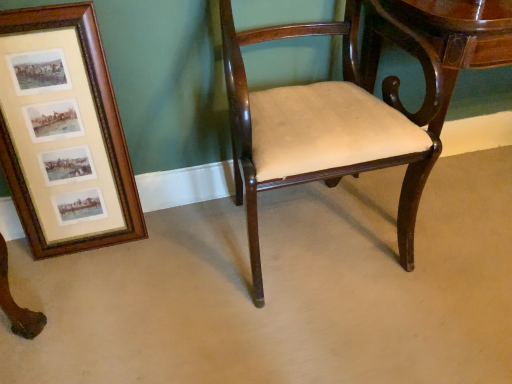
Describe the element at coordinates (64, 133) in the screenshot. I see `wooden frame at left` at that location.

Describe the element at coordinates (328, 124) in the screenshot. I see `mahogany wood chair at center` at that location.

I want to click on wooden frame at left, so click(64, 133).

Is mahogany wood chair at center a part of wooden frame at left?

No.

From the image's perspective, is wooden frame at left above mahogany wood chair at center?

Incorrect, from the image's perspective, wooden frame at left is lower than mahogany wood chair at center.

Can you confirm if wooden frame at left is positioned to the left of mahogany wood chair at center?

Yes.

Is wooden frame at left behind mahogany wood chair at center?

Yes, wooden frame at left is further from the viewer.

From the image's perspective, is mahogany wood chair at center located beneath glossy wood table at center?

Correct, mahogany wood chair at center appears lower than glossy wood table at center in the image.

From a real-world perspective, is mahogany wood chair at center physically above glossy wood table at center?

Correct, in the physical world, mahogany wood chair at center is higher than glossy wood table at center.

Is mahogany wood chair at center behind glossy wood table at center?

No, the depth of mahogany wood chair at center is less than that of glossy wood table at center.

From the image's perspective, is mahogany wood chair at center above wooden frame at left?

Correct, mahogany wood chair at center appears higher than wooden frame at left in the image.

Considering the sizes of objects mahogany wood chair at center and wooden frame at left in the image provided, who is taller, mahogany wood chair at center or wooden frame at left?

With more height is mahogany wood chair at center.

At what (x,y) coordinates should I click in order to perform the action: click on picture frame below the mahogany wood chair at center (from the image's perspective). Please return your answer as a coordinate pair (x, y). This screenshot has width=512, height=384. Looking at the image, I should click on (64, 133).

Is mahogany wood chair at center at the left side of wooden frame at left?

Incorrect, mahogany wood chair at center is not on the left side of wooden frame at left.

From a real-world perspective, is wooden frame at left positioned under glossy wood table at center based on gravity?

Incorrect, from a real-world perspective, wooden frame at left is higher than glossy wood table at center.

Based on the photo, is wooden frame at left not close to glossy wood table at center?

No.

Considering the sizes of objects wooden frame at left and glossy wood table at center in the image provided, who is wider, wooden frame at left or glossy wood table at center?

glossy wood table at center is wider.

From the image's perspective, between glossy wood table at center and mahogany wood chair at center, which one is located above?

glossy wood table at center.

Considering the sizes of objects glossy wood table at center and mahogany wood chair at center in the image provided, who is shorter, glossy wood table at center or mahogany wood chair at center?

With less height is glossy wood table at center.

Is glossy wood table at center thinner than mahogany wood chair at center?

Yes, glossy wood table at center is thinner than mahogany wood chair at center.

Is glossy wood table at center to the right of wooden frame at left from the viewer's perspective?

Yes, glossy wood table at center is to the right of wooden frame at left.

Which object is further away from the camera, glossy wood table at center or wooden frame at left?

glossy wood table at center is further away from the camera.

Would you say glossy wood table at center is inside or outside wooden frame at left?

The correct answer is: outside.

Between glossy wood table at center and wooden frame at left, which one has more height?

wooden frame at left is taller.

Locate an element on the screen. The width and height of the screenshot is (512, 384). picture frame to the left of mahogany wood chair at center is located at coordinates (64, 133).

Locate an element on the screen. This screenshot has width=512, height=384. table that appears on the right of mahogany wood chair at center is located at coordinates (426, 71).

Based on the photo, estimate the real-world distances between objects in this image. Which object is closer to glossy wood table at center, mahogany wood chair at center or wooden frame at left?

Based on the image, mahogany wood chair at center appears to be nearer to glossy wood table at center.

Considering their positions, is wooden frame at left positioned further to mahogany wood chair at center than glossy wood table at center?

wooden frame at left.

Looking at the image, which one is located further to wooden frame at left, mahogany wood chair at center or glossy wood table at center?

Based on the image, glossy wood table at center appears to be further to wooden frame at left.

Based on their spatial positions, is glossy wood table at center or wooden frame at left closer to mahogany wood chair at center?

glossy wood table at center.

Estimate the real-world distances between objects in this image. Which object is closer to glossy wood table at center, wooden frame at left or mahogany wood chair at center?

The object closer to glossy wood table at center is mahogany wood chair at center.

From the picture: From the image, which object appears to be farther from wooden frame at left, glossy wood table at center or mahogany wood chair at center?

The object further to wooden frame at left is glossy wood table at center.

At what (x,y) coordinates should I click in order to perform the action: click on chair situated between wooden frame at left and glossy wood table at center from left to right. Please return your answer as a coordinate pair (x, y). The image size is (512, 384). Looking at the image, I should click on (328, 124).